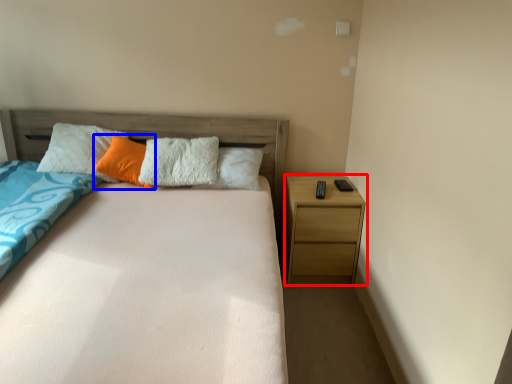
Question: Among these objects, which one is nearest to the camera, nightstand (highlighted by a red box) or pillow (highlighted by a blue box)?

Choices:
 (A) nightstand
 (B) pillow

Answer: (B)